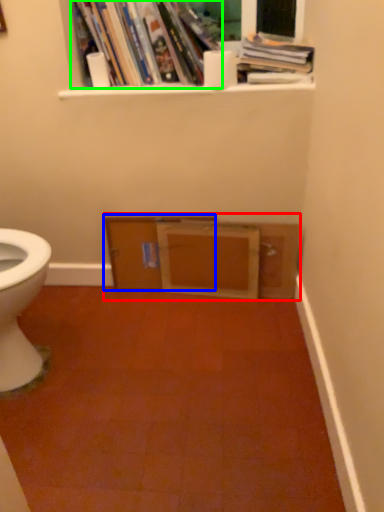
Question: Which is nearer to the entertainment center (highlighted by a red box)? file cabinet (highlighted by a blue box) or book (highlighted by a green box).

Choices:
 (A) file cabinet
 (B) book

Answer: (A)